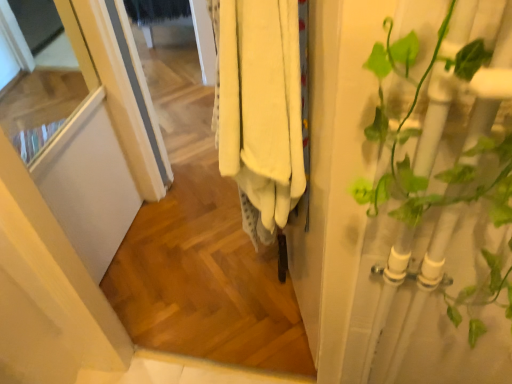
Question: Is white matte screen door at left at the right side of white cotton towels at center?

Choices:
 (A) no
 (B) yes

Answer: (A)

Question: From a real-world perspective, is white matte screen door at left positioned over white cotton towels at center based on gravity?

Choices:
 (A) yes
 (B) no

Answer: (B)

Question: Is white matte screen door at left facing away from white cotton towels at center?

Choices:
 (A) yes
 (B) no

Answer: (B)

Question: Would you say white matte screen door at left contains white cotton towels at center?

Choices:
 (A) yes
 (B) no

Answer: (B)

Question: From the image's perspective, is white matte screen door at left above white cotton towels at center?

Choices:
 (A) no
 (B) yes

Answer: (B)

Question: Is white matte screen door at left in front of or behind white cotton towels at center in the image?

Choices:
 (A) front
 (B) behind

Answer: (B)

Question: From the image's perspective, relative to white cotton towels at center, is white matte screen door at left above or below?

Choices:
 (A) above
 (B) below

Answer: (A)

Question: From a real-world perspective, is white matte screen door at left physically located above or below white cotton towels at center?

Choices:
 (A) above
 (B) below

Answer: (B)

Question: Based on their sizes in the image, would you say white matte screen door at left is bigger or smaller than white cotton towels at center?

Choices:
 (A) small
 (B) big

Answer: (B)

Question: Would you say white cotton towels at center is inside or outside green leafy plant at right?

Choices:
 (A) outside
 (B) inside

Answer: (A)

Question: Would you say white cotton towels at center is to the left or to the right of green leafy plant at right in the picture?

Choices:
 (A) right
 (B) left

Answer: (B)

Question: Is white cotton towels at center bigger or smaller than green leafy plant at right?

Choices:
 (A) small
 (B) big

Answer: (B)

Question: In terms of width, does white cotton towels at center look wider or thinner when compared to green leafy plant at right?

Choices:
 (A) thin
 (B) wide

Answer: (B)

Question: Is green leafy plant at right wider or thinner than white cotton towels at center?

Choices:
 (A) thin
 (B) wide

Answer: (A)

Question: Does point (448, 19) appear closer or farther from the camera than point (265, 127)?

Choices:
 (A) closer
 (B) farther

Answer: (A)